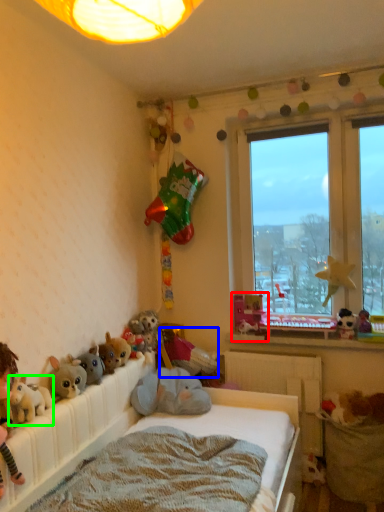
Question: Which is nearer to the toy (highlighted by a red box)? toy (highlighted by a blue box) or toy (highlighted by a green box).

Choices:
 (A) toy
 (B) toy

Answer: (A)